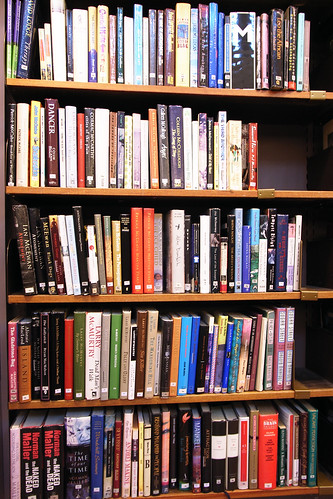
Find the location of a particular element. shelves with books on them is located at coordinates (172, 88), (171, 194), (177, 297), (179, 400), (181, 495).